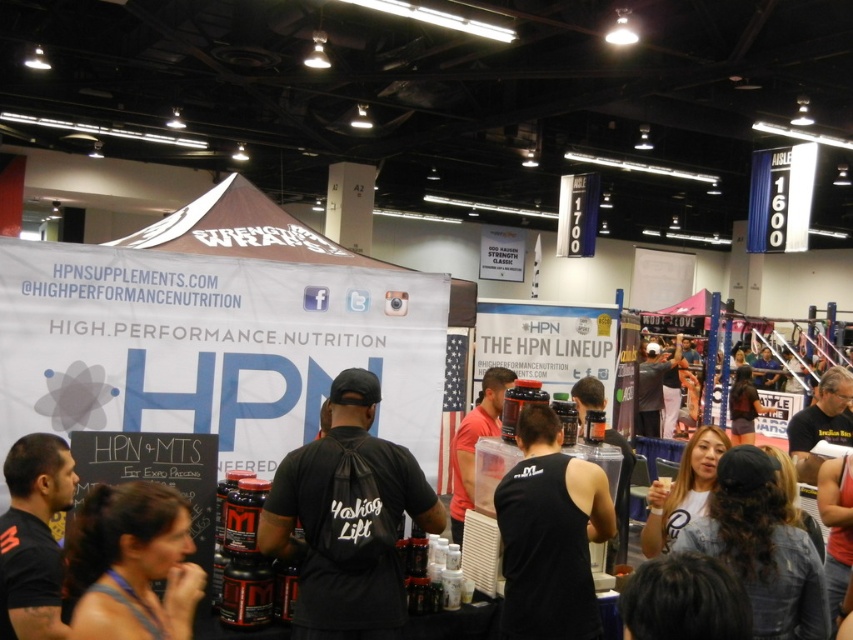
Does point (506, 621) come in front of point (144, 515)?

No, it is not.

Image resolution: width=853 pixels, height=640 pixels. I want to click on black matte tank top at center, so click(549, 534).

Image resolution: width=853 pixels, height=640 pixels. Identify the location of black matte t-shirt at center. (347, 518).

Does point (306, 465) lie behind point (79, 552)?

Yes, it is behind point (79, 552).

Is point (357, 460) closer to camera compared to point (138, 531)?

No, (357, 460) is behind (138, 531).

Locate an element on the screen. This screenshot has width=853, height=640. black matte t-shirt at center is located at coordinates (347, 518).

Who is positioned more to the left, dark brown hair at lower left or black matte shirt at lower left?

From the viewer's perspective, black matte shirt at lower left appears more on the left side.

Where is `dark brown hair at lower left`? The height and width of the screenshot is (640, 853). dark brown hair at lower left is located at coordinates [x=131, y=563].

Describe the element at coordinates (131, 563) in the screenshot. This screenshot has height=640, width=853. I see `dark brown hair at lower left` at that location.

This screenshot has height=640, width=853. I want to click on dark brown hair at lower left, so click(131, 563).